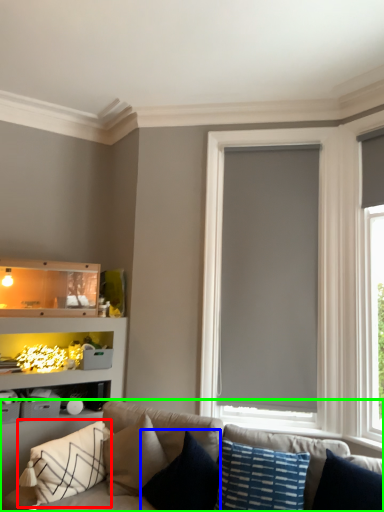
Question: Based on their relative distances, which object is nearer to pillow (highlighted by a red box)? Choose from pillow (highlighted by a blue box) and studio couch (highlighted by a green box).

Choices:
 (A) pillow
 (B) studio couch

Answer: (B)